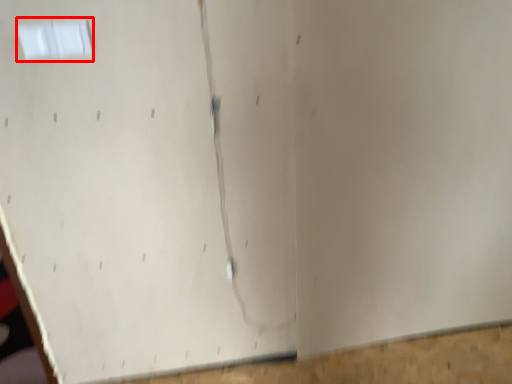
Question: From the image's perspective, where is window (annotated by the red box) located in relation to plywood in the image?

Choices:
 (A) above
 (B) below

Answer: (A)